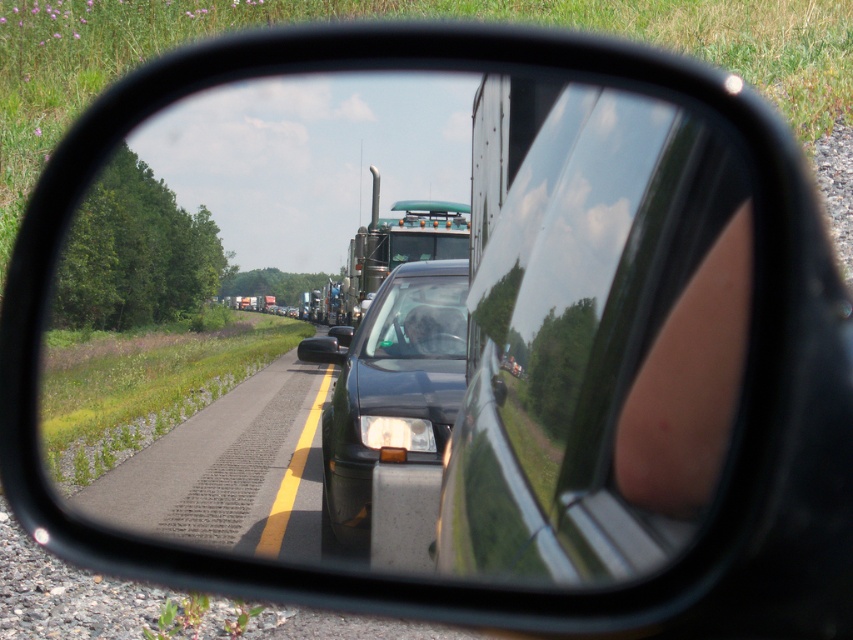
Question: Which of the following is the farthest from the observer?

Choices:
 (A) glossy metallic mirror at center
 (B) shiny black sedan at center
 (C) asphalt road at lower left

Answer: (C)

Question: Among these points, which one is farthest from the camera?

Choices:
 (A) (398, 310)
 (B) (704, 221)

Answer: (A)

Question: Is asphalt road at lower left below shiny black sedan at center?

Choices:
 (A) yes
 (B) no

Answer: (A)

Question: Which object appears farthest from the camera in this image?

Choices:
 (A) glossy metallic mirror at center
 (B) shiny black sedan at center
 (C) asphalt road at lower left

Answer: (C)

Question: Does asphalt road at lower left appear on the right side of shiny black sedan at center?

Choices:
 (A) no
 (B) yes

Answer: (A)

Question: Where is glossy metallic mirror at center located in relation to shiny black sedan at center in the image?

Choices:
 (A) left
 (B) right

Answer: (B)